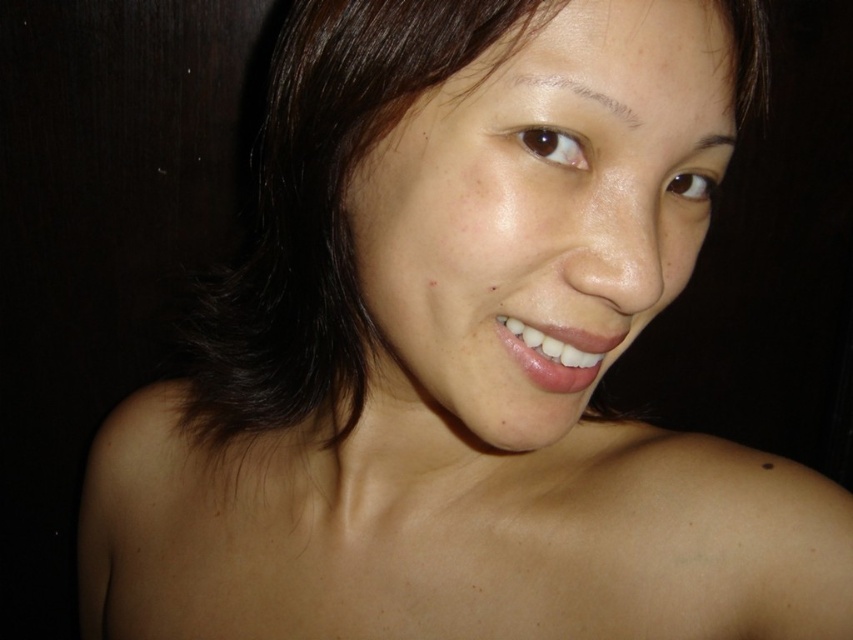
You are an artist sketching the portrait and want to ensure proper layering. Which of the two points, point (711, 19) or point (625, 109), should be drawn first if you are layering from front to back?

Point (625, 109) should be drawn first because it is in front of point (711, 19), so you should start with the front layers before moving to the ones behind.

You are a photographer adjusting the lighting for a close portrait. You notice two sections of dark brown hair at upper center and dark brown hair at upper right. Given that the distance between them is critical for proper lighting, can you confirm if the gap between them is more than 2 inches?

The dark brown hair at upper center is 2.55 inches from the dark brown hair at upper right, so yes, the gap between them is more than 2 inches.

You are taking a photo of a person and want to focus on the point closer to the camera. Which of the two points, point (585, 301) or point (726, 132), should you choose?

Point (585, 301) is closer to the camera than point (726, 132), so you should choose point (585, 301) to focus on.